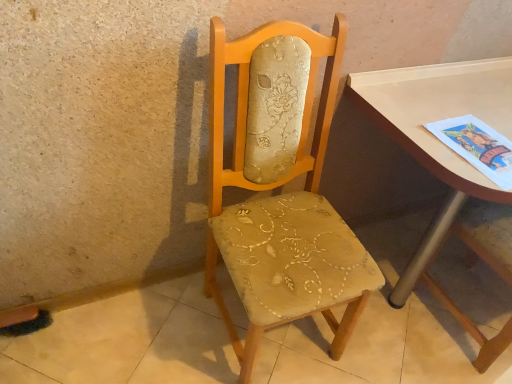
Locate an element on the screen. vacant area to the left of matte beige fabric chair at center is located at coordinates (158, 330).